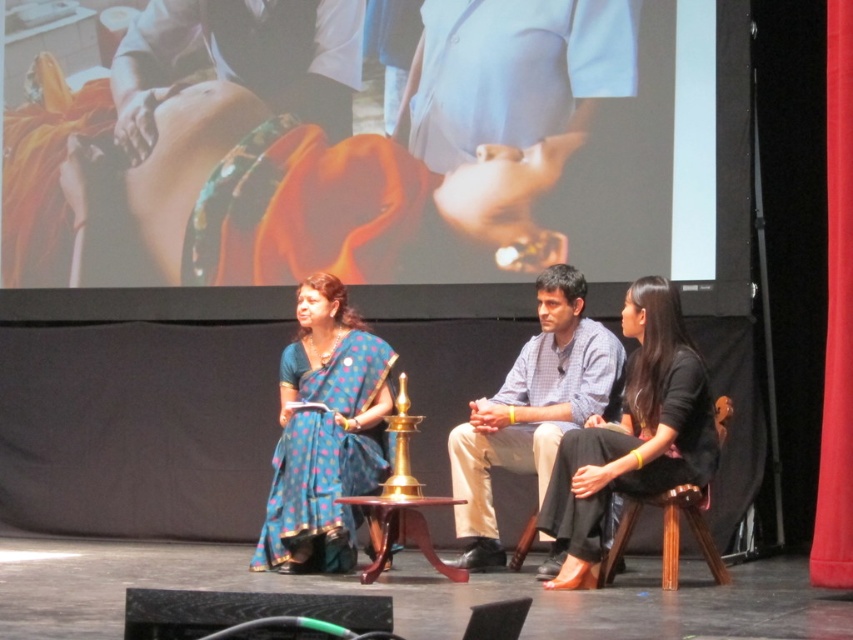
You are an event planner arranging seating for an upcoming presentation. You need to place a name tag on either the blue polka dot sari at center or the mahogany wood stool at center. Which object should you choose to ensure the name tag is visible to the audience?

The blue polka dot sari at center is above the mahogany wood stool at center, so placing the name tag on the blue polka dot sari at center would ensure better visibility as it is higher up.

You are a stagehand who needs to adjust the lighting for the presenter wearing the light blue checkered shirt at center. The control panel indicates that the spotlight can only reach up to 2 meters. Can you effectively illuminate the presenter from the red fabric curtain at right?

The light blue checkered shirt at center is 2.21 meters away from the red fabric curtain at right. Since the spotlight can only reach up to 2 meters, it cannot effectively illuminate the presenter from that distance.

You are an attendee at the stage event and want to take a photo of both point [613,360] and point [842,225]. Which point is closer to you so that you can focus your camera on it first?

Point [613,360] is closer to you than point [842,225], so you should focus your camera on point [613,360] first.